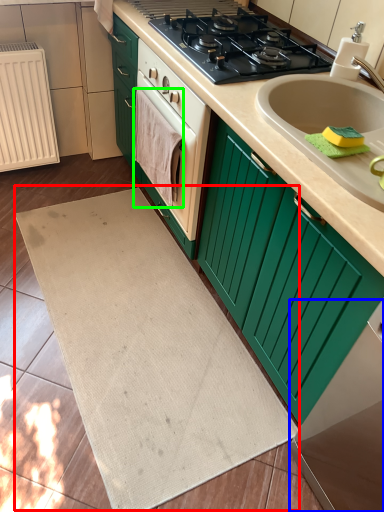
Question: Considering the real-world distances, which object is closest to bath mat (highlighted by a red box)? appliance (highlighted by a blue box) or hand towel (highlighted by a green box).

Choices:
 (A) appliance
 (B) hand towel

Answer: (A)